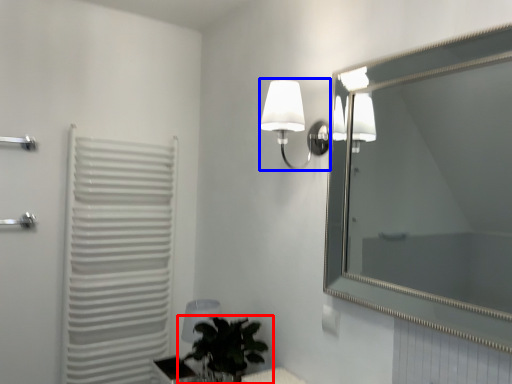
Question: Which object is further to the camera taking this photo, houseplant (highlighted by a red box) or lamp (highlighted by a blue box)?

Choices:
 (A) houseplant
 (B) lamp

Answer: (A)